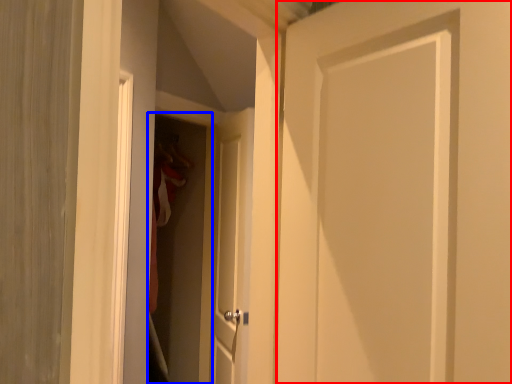
Question: Which object is closer to the camera taking this photo, door (highlighted by a red box) or screen door (highlighted by a blue box)?

Choices:
 (A) door
 (B) screen door

Answer: (A)